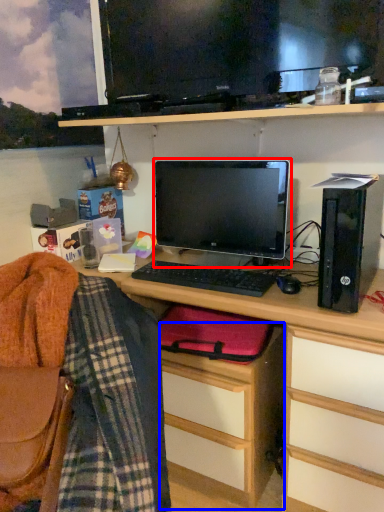
Question: Which of the following is the farthest to the observer, computer monitor (highlighted by a red box) or file cabinet (highlighted by a blue box)?

Choices:
 (A) computer monitor
 (B) file cabinet

Answer: (A)